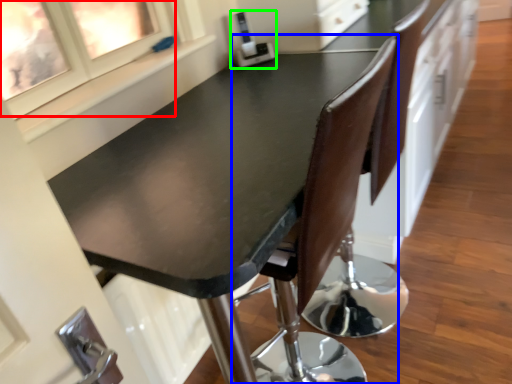
Question: Which object is the closest to the window (highlighted by a red box)? Choose among these: chair (highlighted by a blue box) or appliance (highlighted by a green box).

Choices:
 (A) chair
 (B) appliance

Answer: (B)